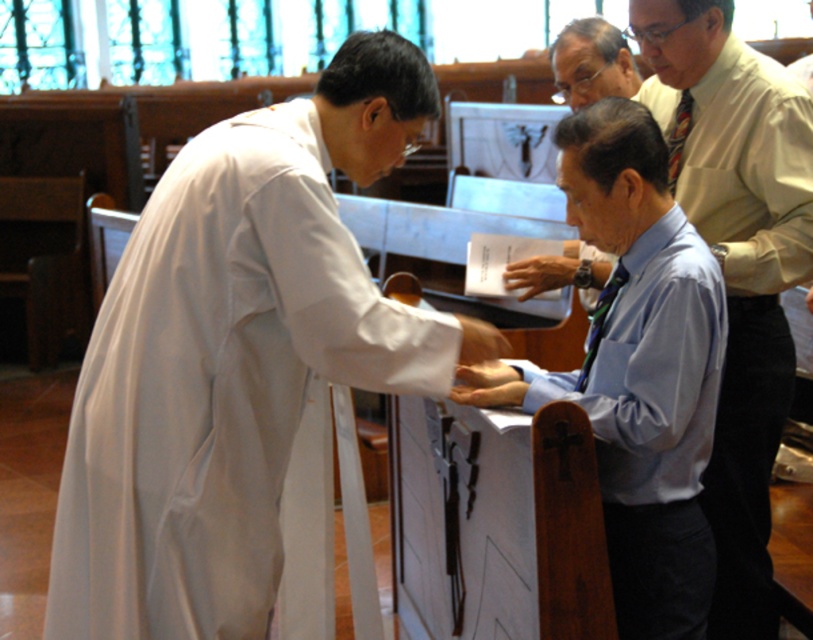
You are standing in the church and want to hand a religious text to the person wearing the white matte robe at upper right. If you can reach up to 2 meters, can you reach them?

The white matte robe at upper right is 2.53 meters from the viewer, so you cannot reach them as your maximum reach is 2 meters.